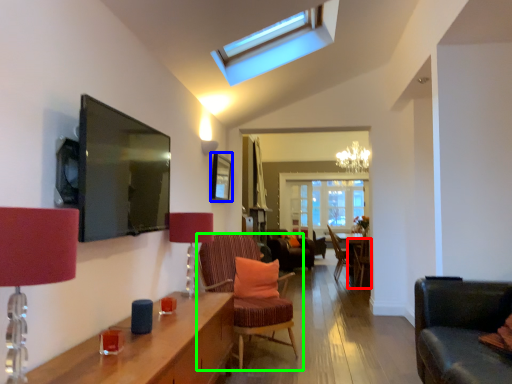
Question: Which object is the farthest from chair (highlighted by a red box)? Choose among these: picture frame (highlighted by a blue box) or chair (highlighted by a green box).

Choices:
 (A) picture frame
 (B) chair

Answer: (B)